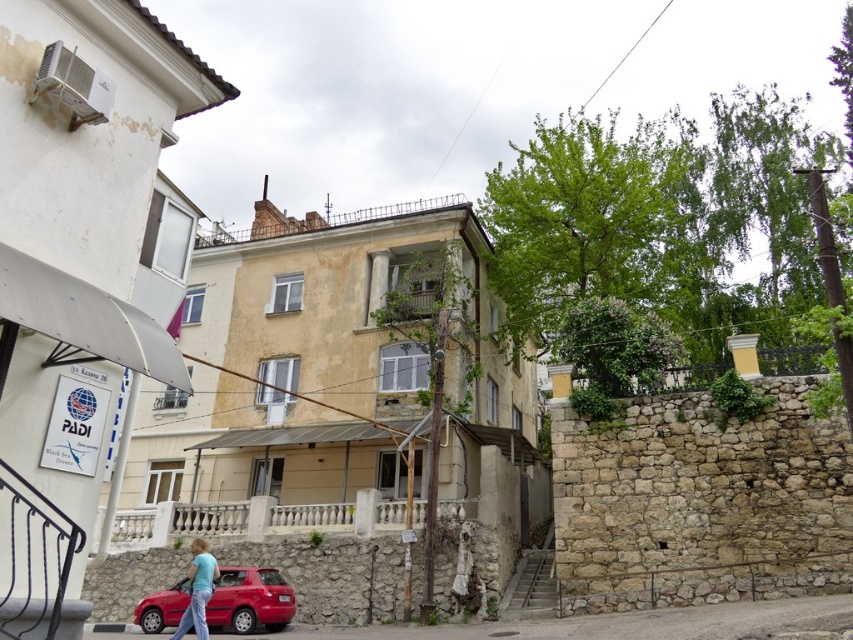
You are a delivery person carrying a package that requires a path 2 meters wide. You need to move from the shiny red car at lower left to the blue cotton shirt at lower center. Can you safely navigate the space between them?

The distance between the shiny red car at lower left and the blue cotton shirt at lower center is 2.19 meters, which is wider than the required 2 meters. Therefore, you can safely navigate the space between them.

You are standing at the base of the staircase in front of the residential building. You notice a shiny red car at lower left and a blue cotton shirt at lower center. Which object is closer to you?

The shiny red car at lower left is closer to you because it is further to the viewer than the blue cotton shirt at lower center.

You are standing at the base of the staircase in front of the residential building. You need to park your car so that it is exactly 40 feet away from the shiny red car at lower left. Is this possible?

The shiny red car at lower left is currently 42.82 feet away from you. To park exactly 40 feet away, you would need to move your car 2.82 feet closer to the shiny red car at lower left.